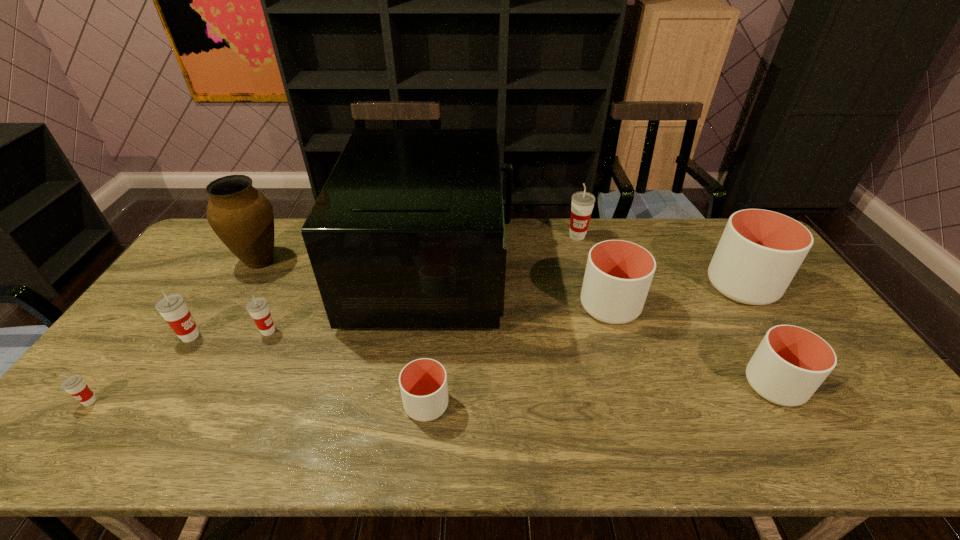
This screenshot has height=540, width=960. I want to click on free space located on the left of the third white cup from right to left, so click(x=506, y=306).

What are the coordinates of `vacant area located on the side of the second biggest red cup with the logo` in the screenshot? It's located at (277, 336).

Find the location of a particular element. The width and height of the screenshot is (960, 540). free space located on the side of the second red cup from right to left with the logo is located at coordinates (327, 331).

Identify the location of free location located 0.200m on the back of the third biggest white cup. The image size is (960, 540). (729, 308).

Locate an element on the screen. This screenshot has height=540, width=960. vacant space located on the back of the smallest white cup is located at coordinates (434, 332).

Where is `free space located on the side of the nearest red cup with the logo`? This screenshot has width=960, height=540. free space located on the side of the nearest red cup with the logo is located at coordinates (58, 443).

At what (x,y) coordinates should I click in order to perform the action: click on microwave_oven that is at the far edge. Please return your answer as a coordinate pair (x, y). Looking at the image, I should click on (408, 232).

The height and width of the screenshot is (540, 960). Find the location of `urn positioned at the far edge`. urn positioned at the far edge is located at coordinates (242, 217).

Where is `cup positioned at the far edge`? cup positioned at the far edge is located at coordinates (582, 204).

I want to click on object present at the near edge, so click(x=423, y=382).